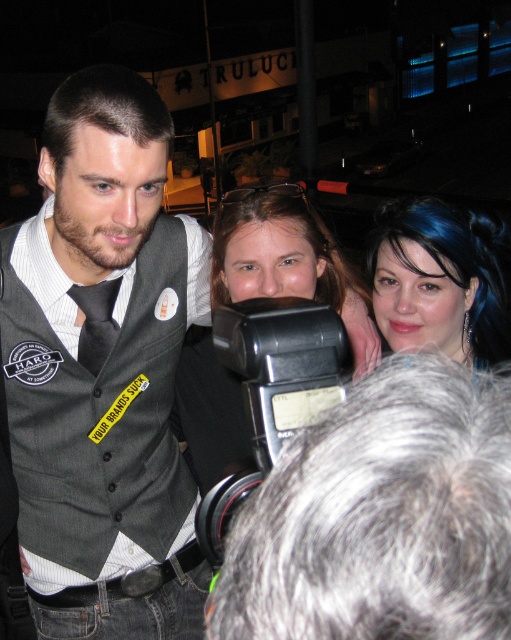
Is black plastic video camera at center thinner than dark gray silk tie at center?

No.

Which is in front, point (220, 346) or point (80, 362)?

Point (220, 346) is more forward.

Where is `black plastic video camera at center`? This screenshot has width=511, height=640. black plastic video camera at center is located at coordinates click(x=272, y=388).

Between point (231, 451) and point (482, 324), which one is positioned behind?

Positioned behind is point (231, 451).

Is matte black camera at center smaller than blue hair at upper right?

No, matte black camera at center is not smaller than blue hair at upper right.

This screenshot has height=640, width=511. What do you see at coordinates (289, 262) in the screenshot?
I see `matte black camera at center` at bounding box center [289, 262].

I want to click on matte black camera at center, so click(289, 262).

Does gray hair at center lie behind matte black camera at center?

No, gray hair at center is in front of matte black camera at center.

Does point (454, 464) come closer to viewer compared to point (218, 278)?

Yes, point (454, 464) is in front of point (218, 278).

Is point (417, 364) farther from viewer compared to point (235, 467)?

Yes, it is behind point (235, 467).

The height and width of the screenshot is (640, 511). What are the coordinates of `gray hair at center` in the screenshot? It's located at (381, 516).